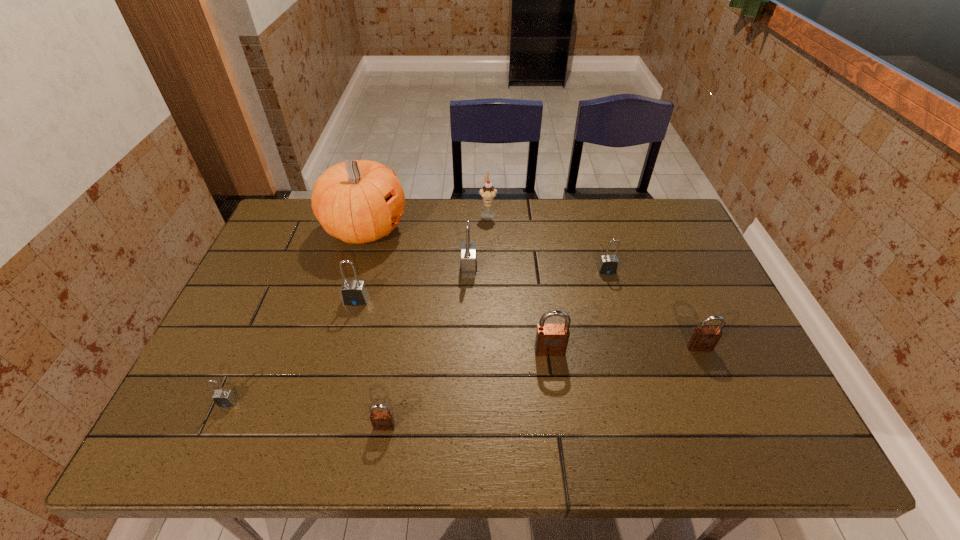
The height and width of the screenshot is (540, 960). In order to click on the tallest object in this screenshot , I will do `click(357, 201)`.

Locate an element on the screen. orange pumpkin is located at coordinates (357, 201).

Identify the location of the fifth object from right to left. Image resolution: width=960 pixels, height=540 pixels. 468,265.

Find the location of a particular element. This screenshot has width=960, height=540. the tallest padlock is located at coordinates (468, 265).

At what (x,y) coordinates should I click in order to perform the action: click on icecream. Please return your answer as a coordinate pair (x, y). The height and width of the screenshot is (540, 960). Looking at the image, I should click on (488, 192).

Find the location of `the second nearest gray padlock`. the second nearest gray padlock is located at coordinates (353, 292).

I want to click on the fifth farthest object, so coord(353,292).

Locate an element on the screen. This screenshot has height=540, width=960. the second brown padlock from right to left is located at coordinates (551, 339).

At what (x,y) coordinates should I click in order to perform the action: click on the third object from right to left. Please return your answer as a coordinate pair (x, y). The height and width of the screenshot is (540, 960). Looking at the image, I should click on (551, 339).

This screenshot has width=960, height=540. Find the location of `the second object from right to left`. the second object from right to left is located at coordinates (608, 264).